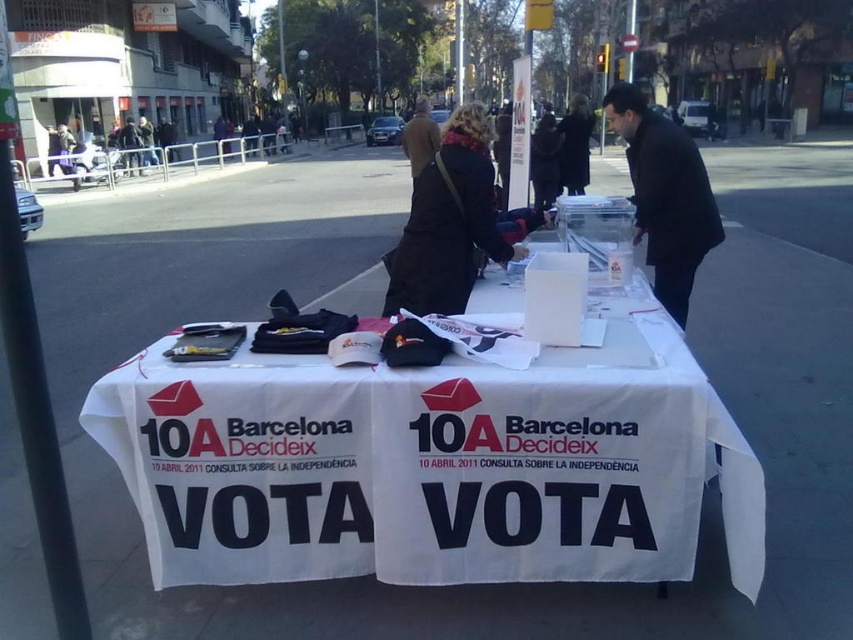
You are a volunteer at the political campaign event. You need to place both the black leather jacket at center and the black wool coat at center on a narrow shelf that can only hold items up to 10 cm in thickness. Which item should you place first to ensure both fit?

The black leather jacket at center is thinner than the black wool coat at center, so you should place the black leather jacket at center first to ensure both items fit on the shelf.

Consider the image. You are a participant at the political event and need to retrieve your coat from the table. Which coat is positioned lower on the table between the black matte coat at center and the black wool coat at center?

The black matte coat at center is located below the black wool coat at center, so it is positioned lower on the table.